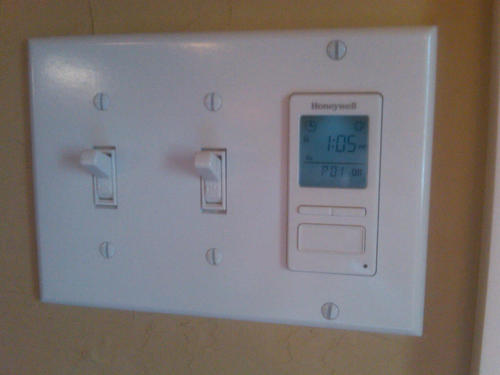
At what (x,y) coordinates should I click in order to perform the action: click on left of light switches. Please return your answer as a coordinate pair (x, y). Looking at the image, I should click on [x=16, y=175].